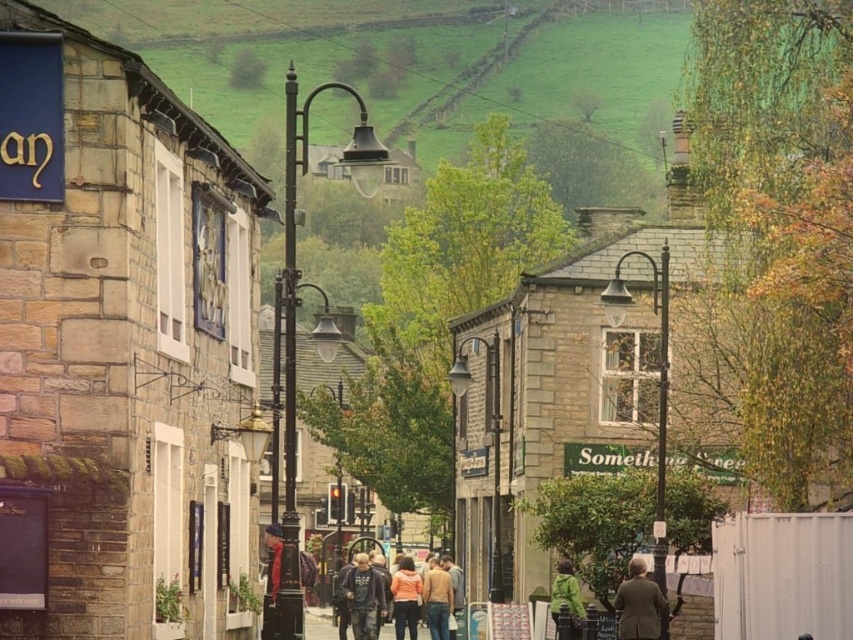
You are a fashion designer observing the street scene. You notice two people wearing a dark blue hoodie at center and a matte orange sweater at center. Which clothing item is taller?

The dark blue hoodie at center is taller than the matte orange sweater at center.